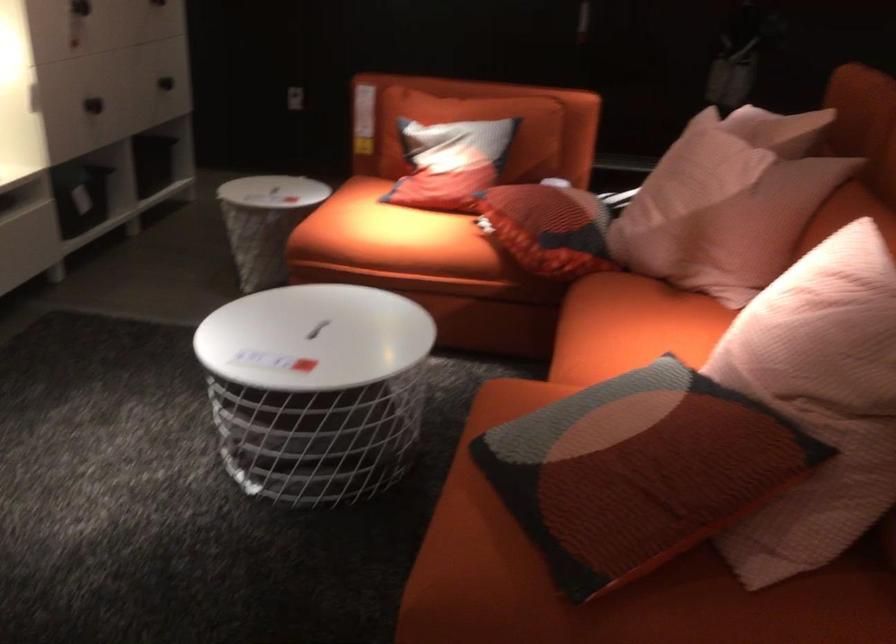
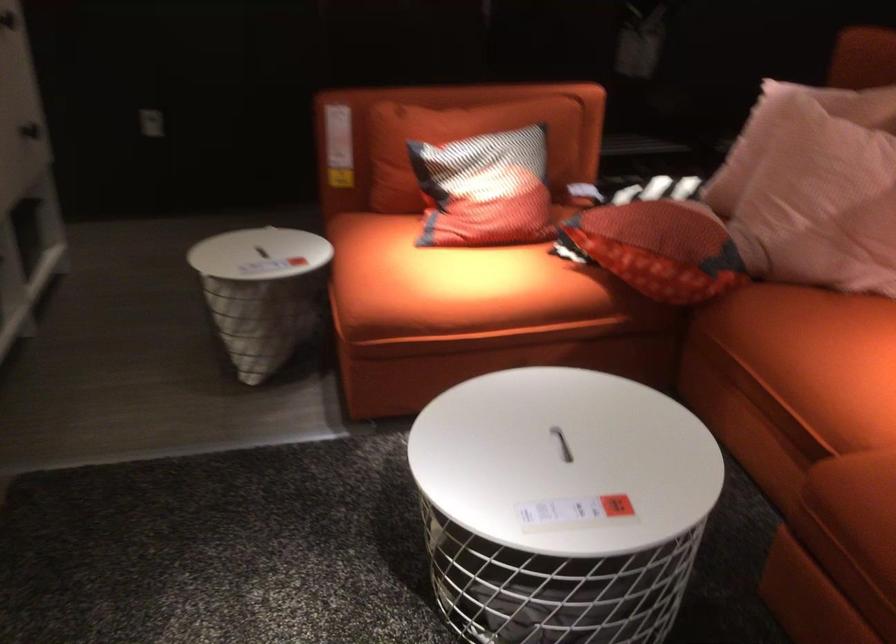
The point at (674,205) is marked in the first image. Where is the corresponding point in the second image?

(823, 198)